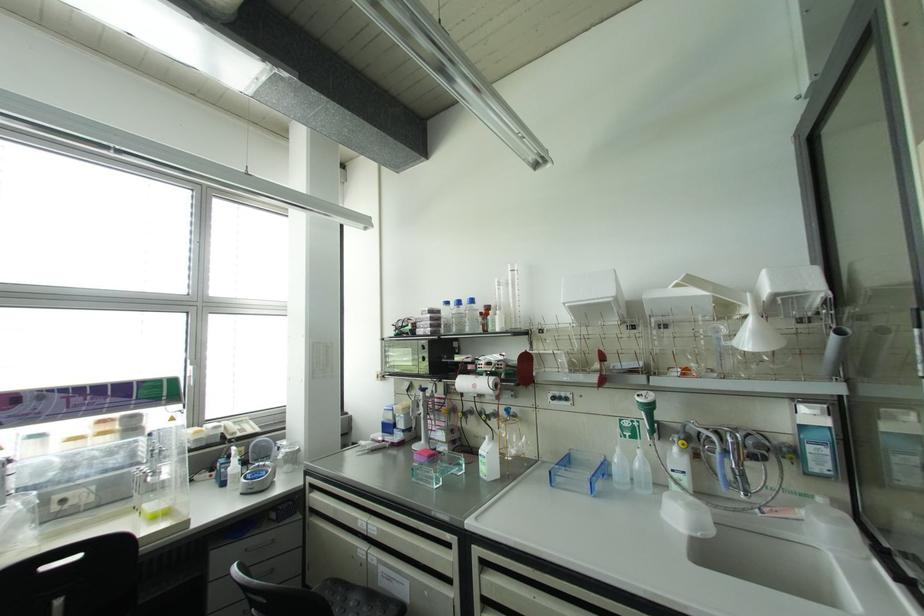
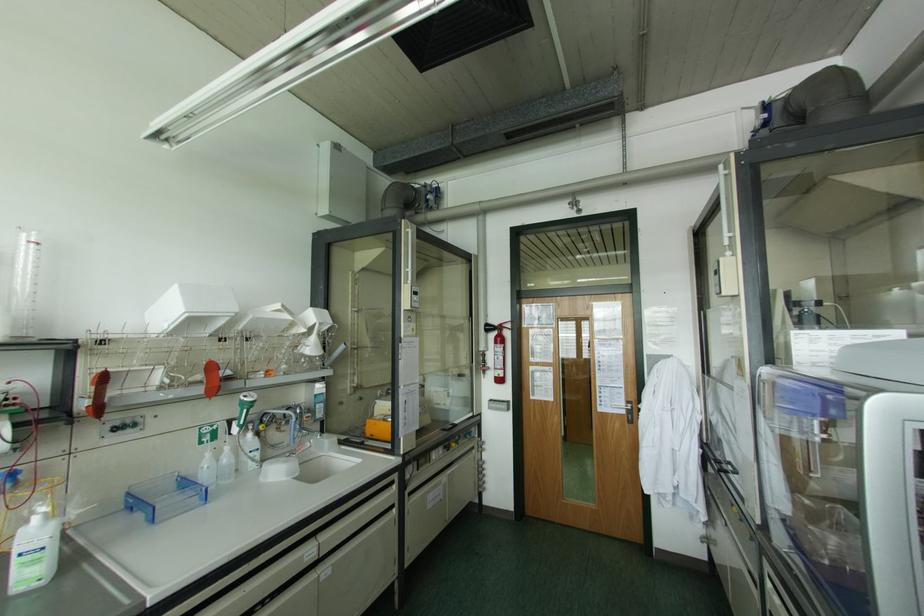
Locate, in the second image, the point that corresponds to pixel 553 398 in the first image.

(115, 428)